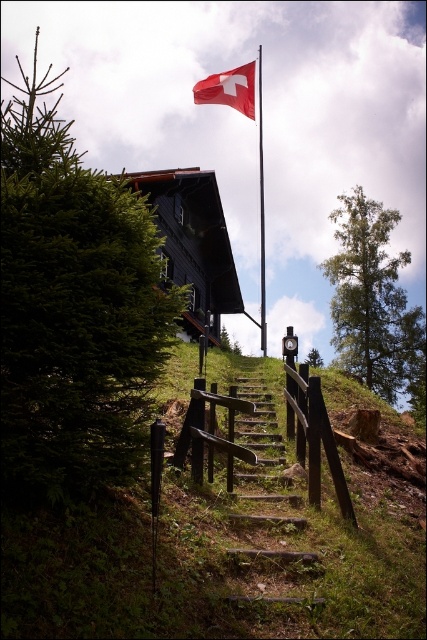
Question: Does wooden stairs at center have a lesser width compared to black wooden cabin at center?

Choices:
 (A) no
 (B) yes

Answer: (B)

Question: Estimate the real-world distances between objects in this image. Which object is farther from the metallic flag pole at upper center?

Choices:
 (A) black wooden cabin at center
 (B) wooden stairs at center
 (C) red fabric flag at upper center

Answer: (B)

Question: Which of the following is the closest to the observer?

Choices:
 (A) (231, 83)
 (B) (259, 134)
 (C) (304, 490)
 (D) (216, 298)

Answer: (C)

Question: Which point is farther to the camera?

Choices:
 (A) (265, 285)
 (B) (225, 291)
 (C) (251, 68)
 (D) (283, 538)

Answer: (A)

Question: In this image, where is black wooden cabin at center located relative to metallic flag pole at upper center?

Choices:
 (A) left
 (B) right

Answer: (A)

Question: Does red fabric flag at upper center appear over metallic flag pole at upper center?

Choices:
 (A) yes
 (B) no

Answer: (B)